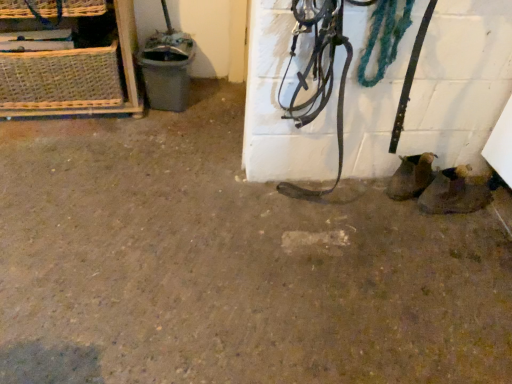
Locate an element on the screen. The height and width of the screenshot is (384, 512). woven straw basket at upper left is located at coordinates (61, 79).

In order to face woven straw basket at upper left, should I rotate leftwards or rightwards?

To align with it, rotate left about 25.210°.

Describe the element at coordinates (61, 79) in the screenshot. I see `woven straw basket at upper left` at that location.

At what (x,y) coordinates should I click in order to perform the action: click on brown leather boots at lower right. Please return your answer as a coordinate pair (x, y). Looking at the image, I should click on (456, 191).

Describe the element at coordinates (456, 191) in the screenshot. I see `brown leather boots at lower right` at that location.

The height and width of the screenshot is (384, 512). What are the coordinates of `woven straw basket at upper left` in the screenshot? It's located at (61, 79).

Would you say brown leather boots at lower right is to the left or to the right of woven straw basket at upper left in the picture?

brown leather boots at lower right is to the right of woven straw basket at upper left.

In the scene shown: Is brown leather boots at lower right further to camera compared to woven straw basket at upper left?

No, brown leather boots at lower right is closer to the camera.

Which is closer to the camera, (450, 196) or (76, 49)?

The point (450, 196) is more forward.

From the image's perspective, would you say brown leather boots at lower right is shown under woven straw basket at upper left?

Indeed, from the image's perspective, brown leather boots at lower right is shown beneath woven straw basket at upper left.

From a real-world perspective, which is physically above, brown leather boots at lower right or woven straw basket at upper left?

woven straw basket at upper left is physically above.

In terms of width, does brown leather boots at lower right look wider or thinner when compared to woven straw basket at upper left?

Considering their sizes, brown leather boots at lower right looks slimmer than woven straw basket at upper left.

Considering the relative sizes of brown leather boots at lower right and woven straw basket at upper left in the image provided, is brown leather boots at lower right taller than woven straw basket at upper left?

No, brown leather boots at lower right is not taller than woven straw basket at upper left.

Considering the sizes of objects brown leather boots at lower right and woven straw basket at upper left in the image provided, who is bigger, brown leather boots at lower right or woven straw basket at upper left?

With larger size is woven straw basket at upper left.

Is woven straw basket at upper left surrounded by brown leather boots at lower right?

That's incorrect, woven straw basket at upper left is not inside brown leather boots at lower right.

Is brown leather boots at lower right far away from woven straw basket at upper left?

Yes, brown leather boots at lower right and woven straw basket at upper left are located far from each other.

Is brown leather boots at lower right facing towards woven straw basket at upper left?

No, brown leather boots at lower right is not facing towards woven straw basket at upper left.

Can you tell me how much brown leather boots at lower right and woven straw basket at upper left differ in facing direction?

89.2 degrees.

In the scene shown: How far apart are brown leather boots at lower right and woven straw basket at upper left?

1.56 meters.

Locate an element on the screen. basket located above the brown leather boots at lower right (from the image's perspective) is located at coordinates (61, 79).

Can you confirm if woven straw basket at upper left is positioned to the right of brown leather boots at lower right?

No.

Which is in front, woven straw basket at upper left or brown leather boots at lower right?

brown leather boots at lower right is closer to the camera.

Between point (67, 78) and point (435, 206), which one is positioned in front?

The point (435, 206) is closer to the camera.

From the image's perspective, relative to brown leather boots at lower right, is woven straw basket at upper left above or below?

Based on their image positions, woven straw basket at upper left is located above brown leather boots at lower right.

From a real-world perspective, who is located higher, woven straw basket at upper left or brown leather boots at lower right?

woven straw basket at upper left is physically above.

Considering the sizes of objects woven straw basket at upper left and brown leather boots at lower right in the image provided, who is wider, woven straw basket at upper left or brown leather boots at lower right?

Wider between the two is woven straw basket at upper left.

Does woven straw basket at upper left have a lesser height compared to brown leather boots at lower right?

Incorrect, the height of woven straw basket at upper left does not fall short of that of brown leather boots at lower right.

Does woven straw basket at upper left have a smaller size compared to brown leather boots at lower right?

Incorrect, woven straw basket at upper left is not smaller in size than brown leather boots at lower right.

Which is correct: woven straw basket at upper left is inside brown leather boots at lower right, or outside of it?

woven straw basket at upper left cannot be found inside brown leather boots at lower right.

Would you say woven straw basket at upper left is a long distance from brown leather boots at lower right?

Yes, woven straw basket at upper left and brown leather boots at lower right are quite far apart.

Is woven straw basket at upper left oriented towards brown leather boots at lower right?

No, woven straw basket at upper left is not oriented towards brown leather boots at lower right.

Where is `basket located on the left of brown leather boots at lower right`? This screenshot has width=512, height=384. basket located on the left of brown leather boots at lower right is located at coordinates (61, 79).

Find the location of `basket on the left of the brown leather boots at lower right`. basket on the left of the brown leather boots at lower right is located at coordinates (61, 79).

This screenshot has height=384, width=512. Identify the location of basket located behind the brown leather boots at lower right. (61, 79).